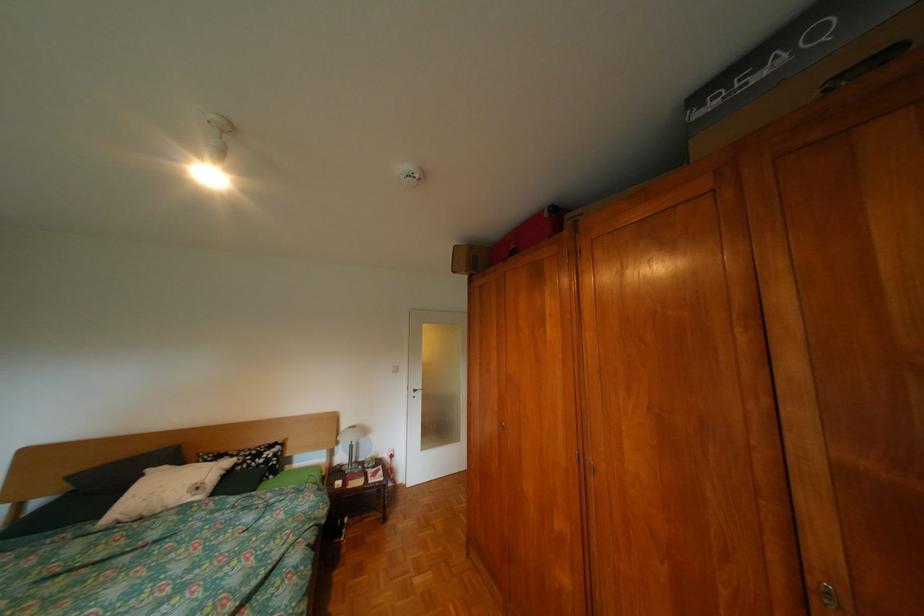
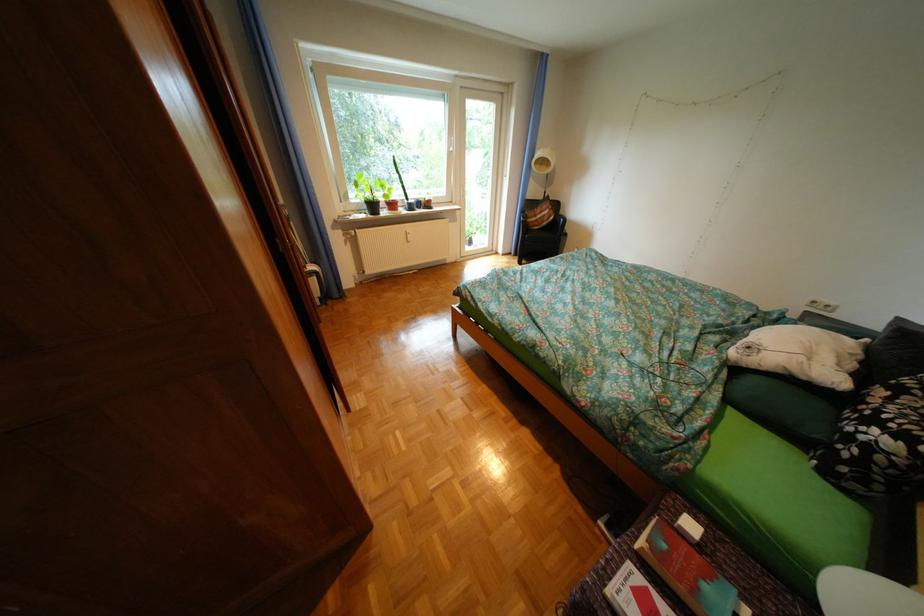
In the second image, find the point that corresponds to [247,456] in the first image.

(904, 399)